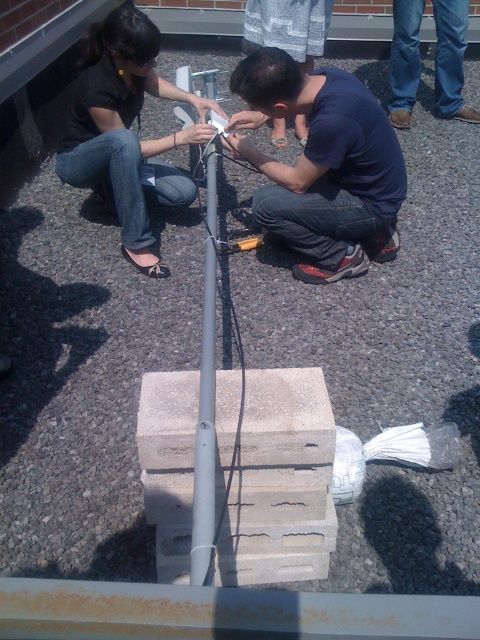
Can you confirm if dark blue shirt at center is positioned above matte black shirt at upper left?

No, dark blue shirt at center is not above matte black shirt at upper left.

Between dark blue shirt at center and matte black shirt at upper left, which one has more height?

With more height is matte black shirt at upper left.

Is point (312, 262) positioned after point (99, 115)?

That is True.

Find the location of `dark blue shirt at center`. dark blue shirt at center is located at coordinates (321, 163).

Based on the photo, between matte black shirt at upper left and blue jeans at upper right, which one appears on the left side from the viewer's perspective?

matte black shirt at upper left

Who is taller, matte black shirt at upper left or blue jeans at upper right?

With more height is matte black shirt at upper left.

What do you see at coordinates (126, 131) in the screenshot? I see `matte black shirt at upper left` at bounding box center [126, 131].

Identify the location of matte black shirt at upper left. This screenshot has width=480, height=640. (126, 131).

Is dark blue shirt at center shorter than gray metallic pole at center?

Correct, dark blue shirt at center is not as tall as gray metallic pole at center.

The height and width of the screenshot is (640, 480). Describe the element at coordinates (321, 163) in the screenshot. I see `dark blue shirt at center` at that location.

Is point (330, 104) less distant than point (199, 74)?

Yes, point (330, 104) is closer to viewer.

Where is `dark blue shirt at center`? Image resolution: width=480 pixels, height=640 pixels. dark blue shirt at center is located at coordinates (321, 163).